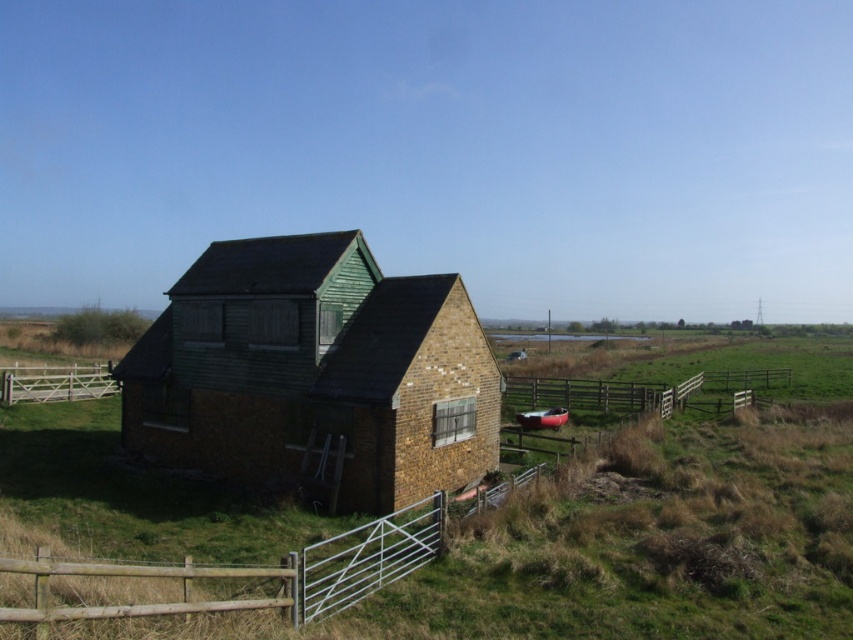
Question: Estimate the real-world distances between objects in this image. Which object is closer to the green wooden hut at center?

Choices:
 (A) wooden at lower left
 (B) white wooden gate at left
 (C) wooden fence at lower right

Answer: (A)

Question: Does wooden at lower left lie behind wooden fence at lower right?

Choices:
 (A) yes
 (B) no

Answer: (B)

Question: Is wooden at lower left below white wooden gate at left?

Choices:
 (A) no
 (B) yes

Answer: (B)

Question: Is green wooden hut at center below wooden at lower left?

Choices:
 (A) yes
 (B) no

Answer: (B)

Question: Estimate the real-world distances between objects in this image. Which object is closer to the wooden fence at lower right?

Choices:
 (A) white wooden gate at left
 (B) wooden at lower left
 (C) green wooden hut at center

Answer: (C)

Question: Among these objects, which one is nearest to the camera?

Choices:
 (A) wooden at lower left
 (B) white wooden gate at left
 (C) green wooden hut at center

Answer: (A)